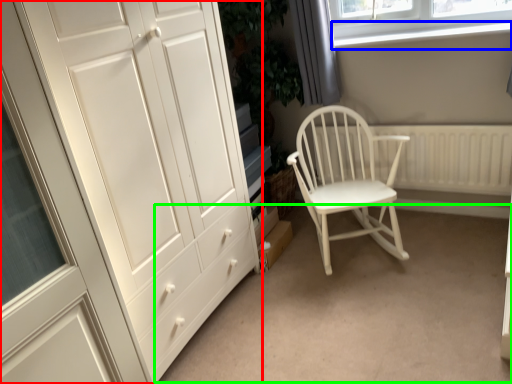
Question: Estimate the real-world distances between objects in this image. Which object is farther from cupboard (highlighted by a red box), window sill (highlighted by a blue box) or plain (highlighted by a green box)?

Choices:
 (A) window sill
 (B) plain

Answer: (A)